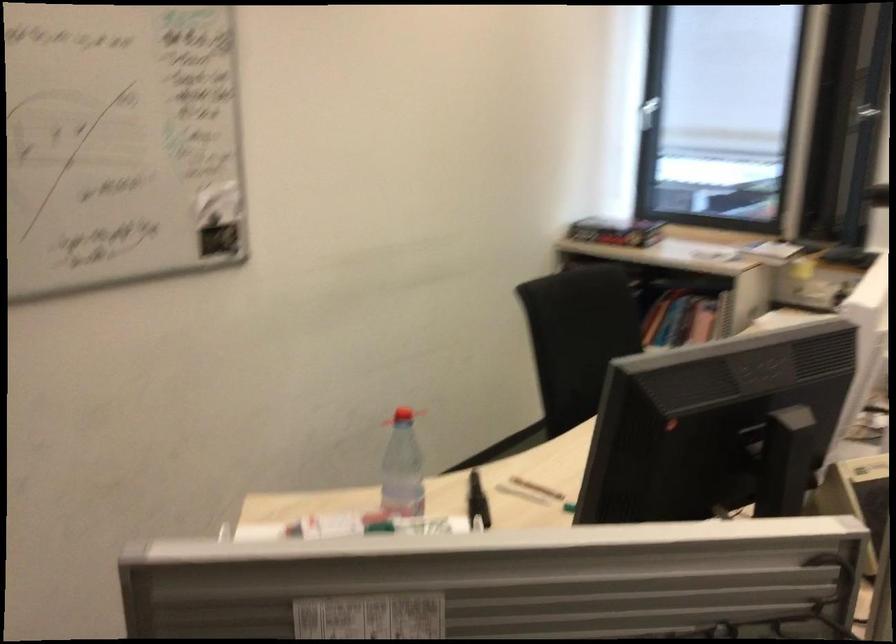
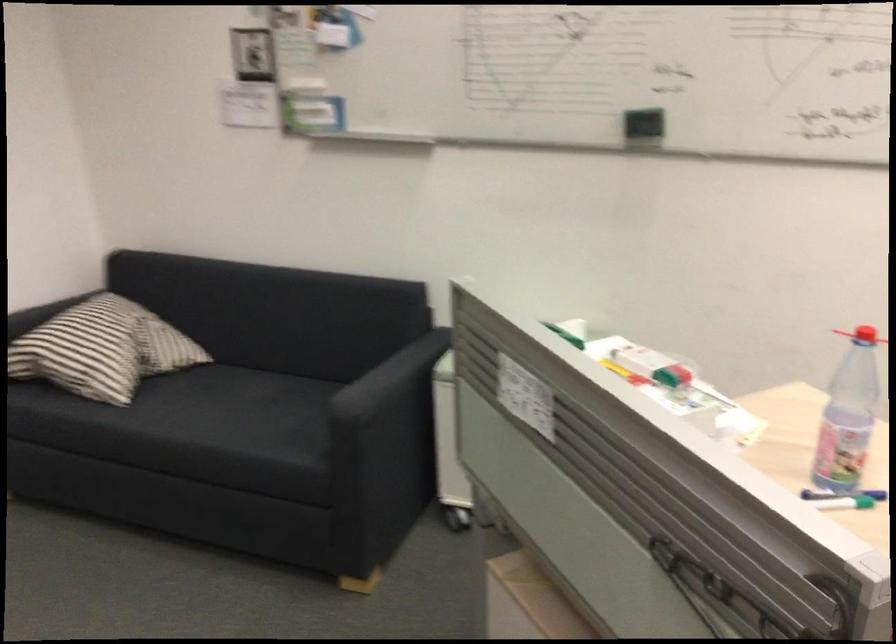
First-person continuous shooting, in which direction is the camera rotating?

The camera's rotation is toward left-down.